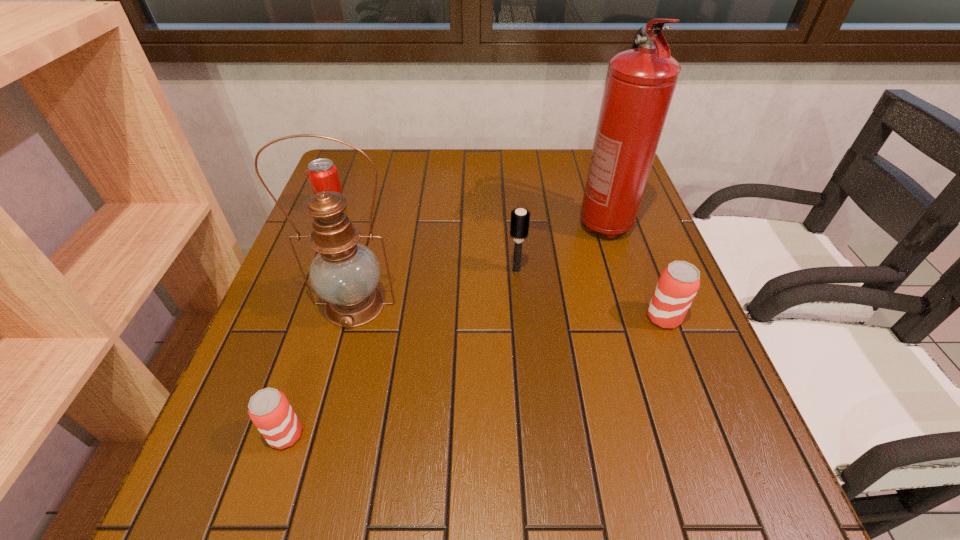
The height and width of the screenshot is (540, 960). Find the location of `fire extinguisher that is at the right edge`. fire extinguisher that is at the right edge is located at coordinates (640, 83).

Locate an element on the screen. The height and width of the screenshot is (540, 960). object located in the near left corner section of the desktop is located at coordinates (269, 409).

Locate an element on the screen. This screenshot has height=540, width=960. free spot at the far edge of the desktop is located at coordinates (484, 164).

The width and height of the screenshot is (960, 540). Identify the location of blank space at the near edge of the desktop. (459, 436).

At what (x,y) coordinates should I click in order to perform the action: click on vacant space at the left edge of the desktop. Please return your answer as a coordinate pair (x, y). This screenshot has height=540, width=960. Looking at the image, I should click on (314, 345).

This screenshot has width=960, height=540. Find the location of `free region at the right edge of the desktop`. free region at the right edge of the desktop is located at coordinates (648, 292).

The width and height of the screenshot is (960, 540). In the image, there is a desktop. In order to click on vacant area at the near right corner in this screenshot , I will do `click(669, 430)`.

Identify the location of free space that is in between the tallest object and the fourth nearest object. (561, 247).

This screenshot has width=960, height=540. Find the location of `empty space between the third tallest object and the farther beer can`. empty space between the third tallest object and the farther beer can is located at coordinates (589, 294).

I want to click on unoccupied position between the shorter beer can and the fire extinguisher, so click(445, 329).